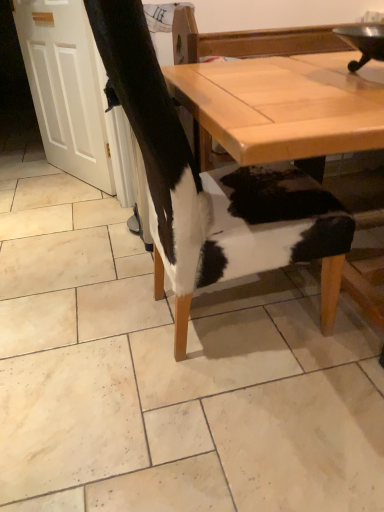
Image resolution: width=384 pixels, height=512 pixels. Find the location of `vacant space that is to the left of cowhide at center`. vacant space that is to the left of cowhide at center is located at coordinates (79, 232).